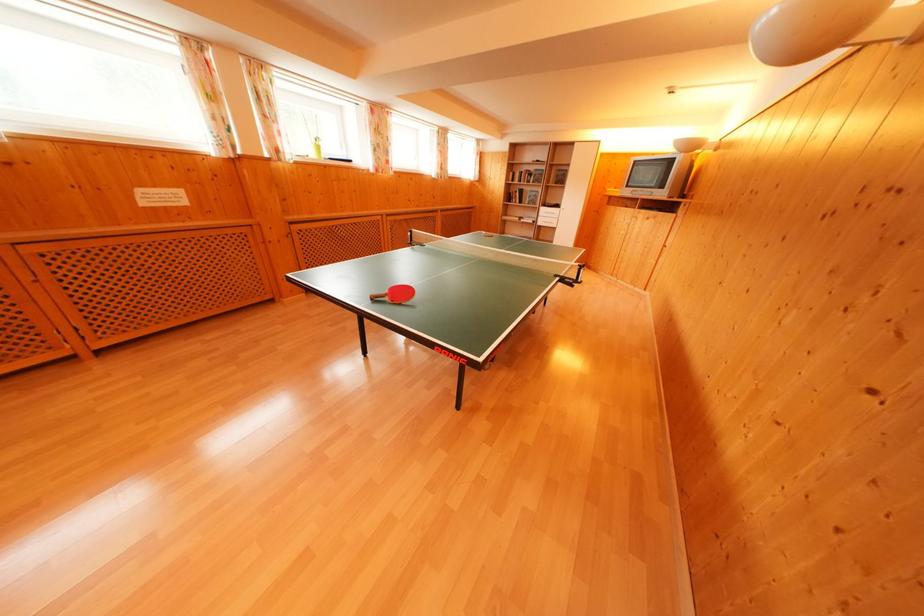
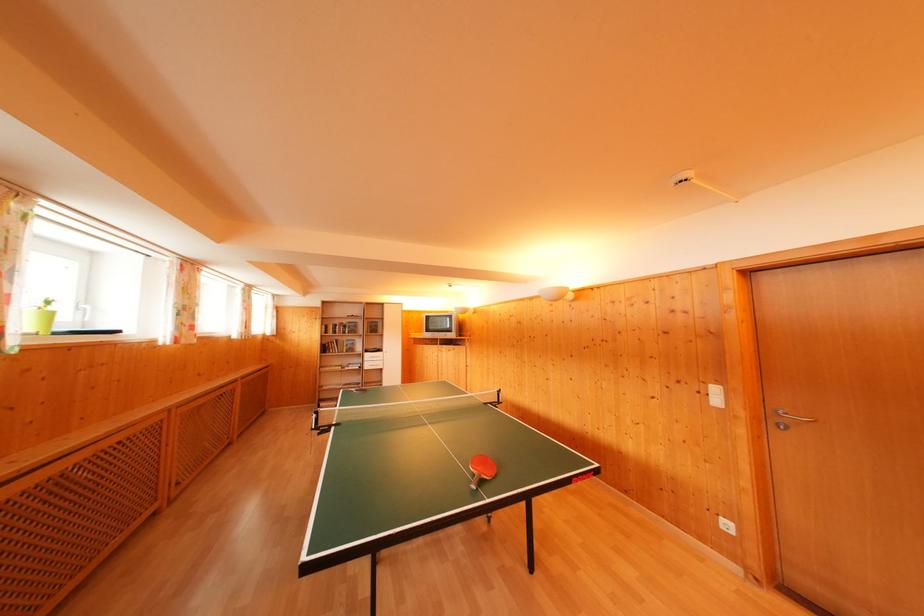
Where in the second image is the point corresponding to point 537,174 from the first image?

(349, 326)